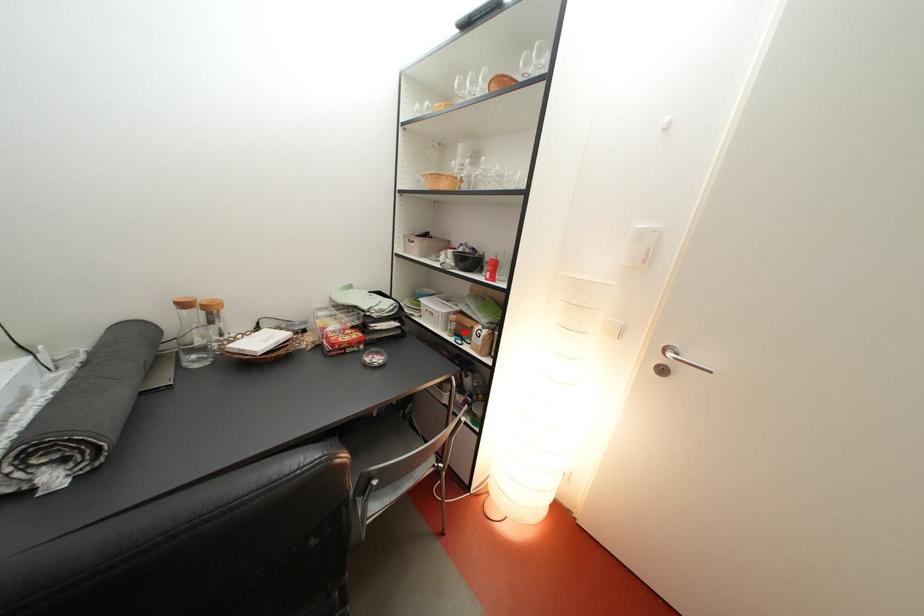
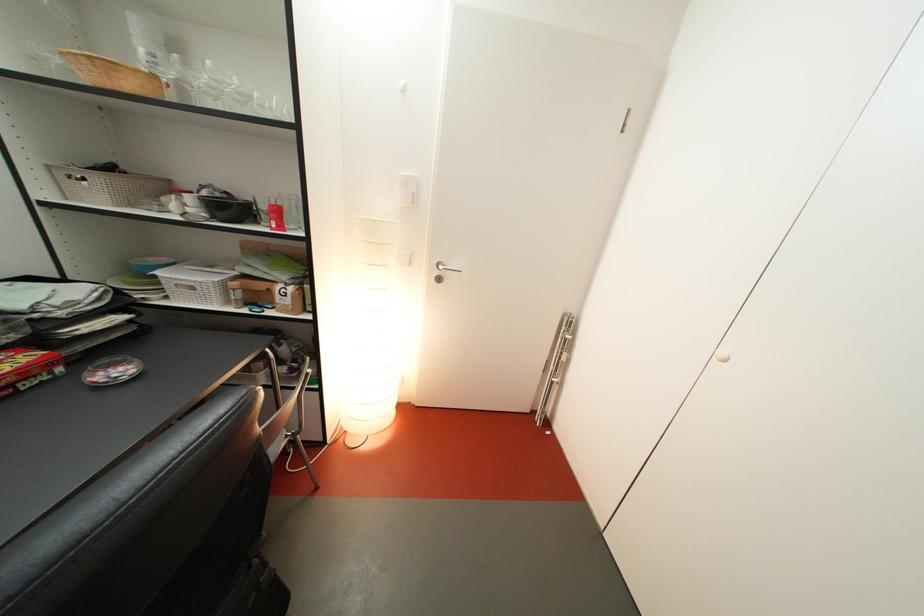
Find the pixel in the second image that matches the highlighted location in the first image.

(249, 301)